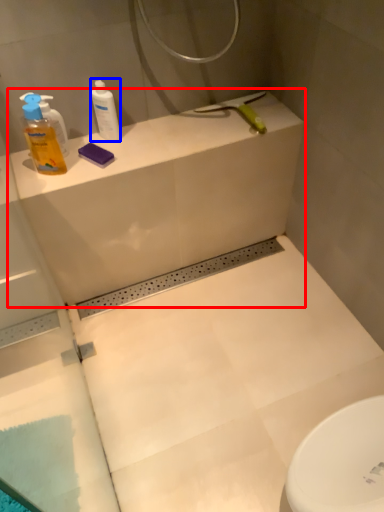
Question: Which object is further to the camera taking this photo, counter top (highlighted by a red box) or cleaning product (highlighted by a blue box)?

Choices:
 (A) counter top
 (B) cleaning product

Answer: (B)